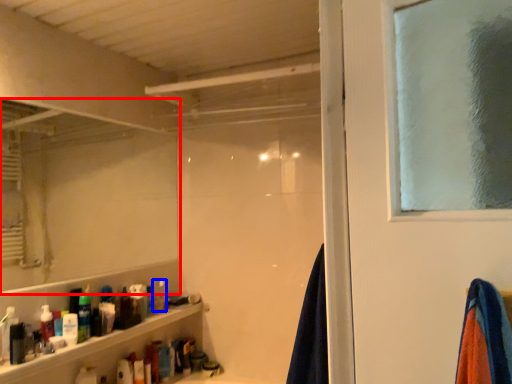
Question: Which of the following is the closest to the observer, mirror (highlighted by a red box) or toiletry (highlighted by a blue box)?

Choices:
 (A) mirror
 (B) toiletry

Answer: (A)